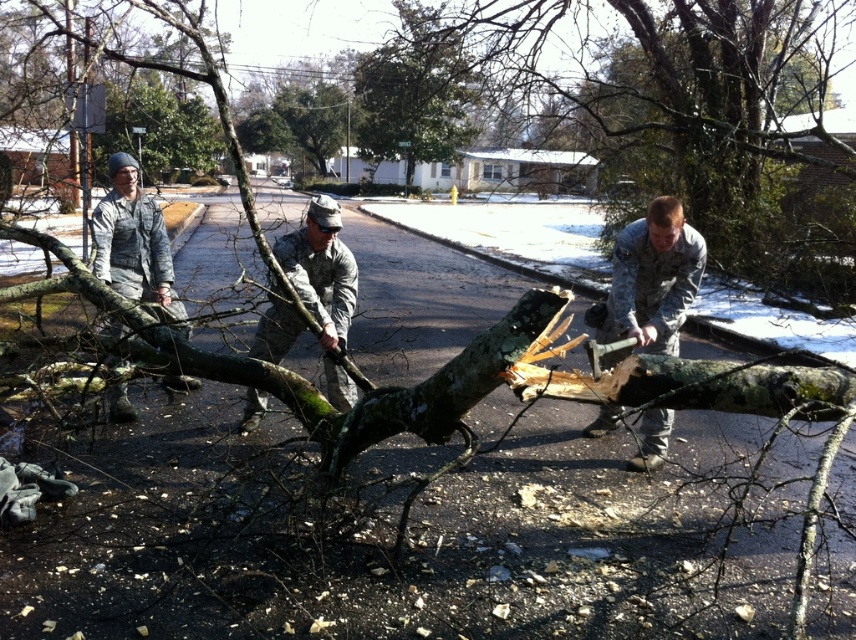
Question: Does camouflage uniform at center come behind green camouflage uniform at center?

Choices:
 (A) yes
 (B) no

Answer: (B)

Question: Which object appears closest to the camera in this image?

Choices:
 (A) green leafy tree at center
 (B) green camouflage uniform at center
 (C) camouflage uniform at center
 (D) camouflage uniform at left

Answer: (C)

Question: Can you confirm if green leafy tree at center is bigger than green camouflage uniform at center?

Choices:
 (A) no
 (B) yes

Answer: (B)

Question: Which object is positioned closest to the green leafy tree at center?

Choices:
 (A) green camouflage uniform at center
 (B) camouflage uniform at center
 (C) camouflage uniform at left

Answer: (B)

Question: Does green leafy tree at center have a larger size compared to green camouflage uniform at center?

Choices:
 (A) yes
 (B) no

Answer: (A)

Question: Which of the following is the closest to the observer?

Choices:
 (A) (325, 259)
 (B) (438, 106)
 (C) (193, 381)

Answer: (A)